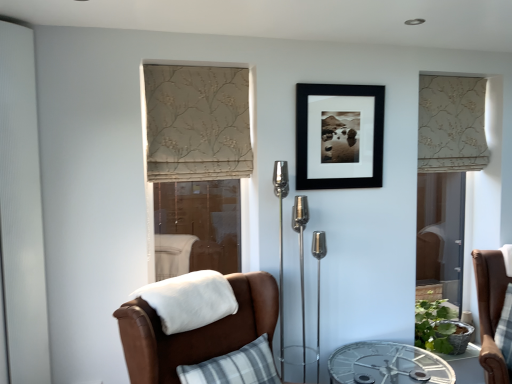
Question: From the image's perspective, is clear glass table at center on top of beige floral fabric curtain at right, which is the 2th curtain in left-to-right order?

Choices:
 (A) yes
 (B) no

Answer: (B)

Question: Can you confirm if clear glass table at center is taller than beige floral fabric curtain at right, the 2th curtain when ordered from front to back?

Choices:
 (A) no
 (B) yes

Answer: (A)

Question: Does clear glass table at center come behind beige floral fabric curtain at right, arranged as the first curtain when viewed from the back?

Choices:
 (A) yes
 (B) no

Answer: (B)

Question: Does clear glass table at center appear on the right side of beige floral fabric curtain at right, which is the 2th curtain in left-to-right order?

Choices:
 (A) no
 (B) yes

Answer: (A)

Question: Is clear glass table at center placed right next to beige floral fabric curtain at right, which is the 2th curtain in left-to-right order?

Choices:
 (A) yes
 (B) no

Answer: (B)

Question: Is clear glass table at center in front of or behind transparent glass screen door at center, marked as the second screen door in a back-to-front arrangement, in the image?

Choices:
 (A) behind
 (B) front

Answer: (B)

Question: Based on their sizes in the image, would you say clear glass table at center is bigger or smaller than transparent glass screen door at center, placed as the 2th screen door when sorted from right to left?

Choices:
 (A) small
 (B) big

Answer: (B)

Question: From a real-world perspective, relative to transparent glass screen door at center, which is the 2th screen door from front to back, is clear glass table at center vertically above or below?

Choices:
 (A) below
 (B) above

Answer: (A)

Question: Is clear glass table at center wider or thinner than transparent glass screen door at center, marked as the second screen door in a left-to-right arrangement?

Choices:
 (A) thin
 (B) wide

Answer: (B)

Question: Considering the relative positions of beige floral fabric curtain at center, the second curtain positioned from the right, and clear glass table at center in the image provided, is beige floral fabric curtain at center, the second curtain positioned from the right, to the left or to the right of clear glass table at center?

Choices:
 (A) left
 (B) right

Answer: (A)

Question: Is beige floral fabric curtain at center, which ranks as the first curtain in left-to-right order, in front of or behind clear glass table at center in the image?

Choices:
 (A) behind
 (B) front

Answer: (A)

Question: Considering the positions of point (148, 104) and point (378, 379), is point (148, 104) closer or farther from the camera than point (378, 379)?

Choices:
 (A) farther
 (B) closer

Answer: (A)

Question: In terms of height, does beige floral fabric curtain at center, marked as the second curtain in a back-to-front arrangement, look taller or shorter compared to clear glass table at center?

Choices:
 (A) tall
 (B) short

Answer: (A)

Question: In the image, is clear glass table at center positioned in front of or behind clear glass screen door at right, the 3th screen door viewed from the left?

Choices:
 (A) behind
 (B) front

Answer: (B)

Question: In terms of size, does clear glass table at center appear bigger or smaller than clear glass screen door at right, the 3th screen door viewed from the left?

Choices:
 (A) big
 (B) small

Answer: (A)